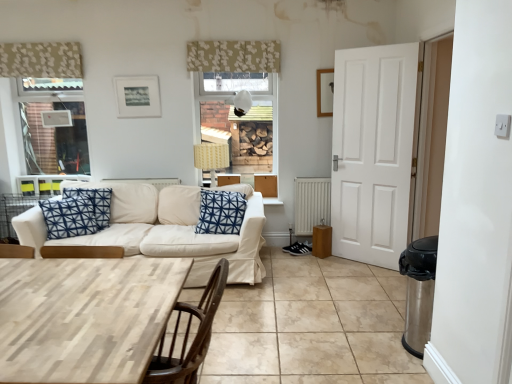
Locate an element on the screen. The width and height of the screenshot is (512, 384). free spot above patterned fabric curtain at upper left, the first curtain viewed from the left (from a real-world perspective) is located at coordinates (34, 42).